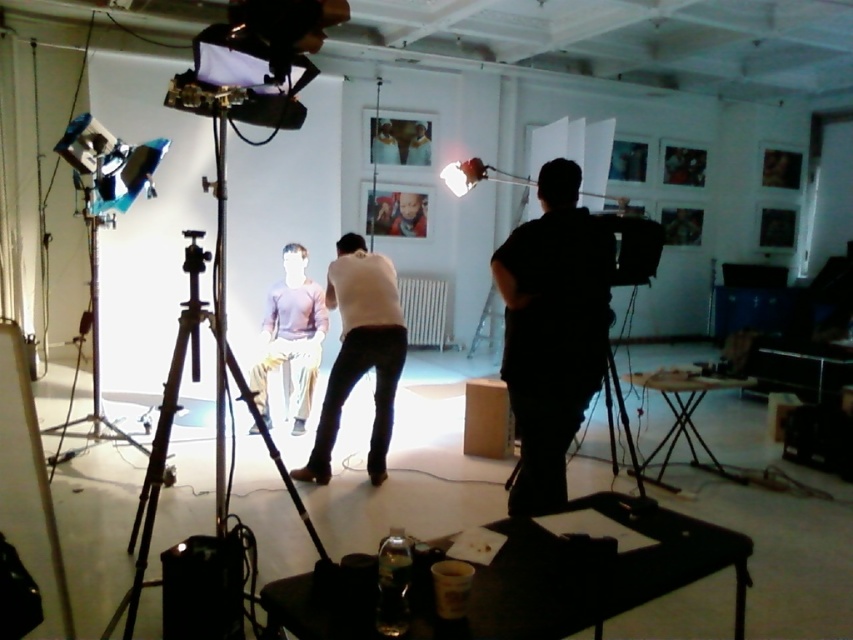
The image size is (853, 640). What do you see at coordinates (360, 353) in the screenshot?
I see `white matte shirt at center` at bounding box center [360, 353].

Is white matte shirt at center to the right of black matte tripod at center from the viewer's perspective?

Yes, white matte shirt at center is to the right of black matte tripod at center.

Is point (302, 474) in front of point (310, 522)?

That is False.

Image resolution: width=853 pixels, height=640 pixels. I want to click on white matte shirt at center, so click(360, 353).

Who is shorter, black matte shirt at right or smooth skin man at upper center?

Standing shorter between the two is smooth skin man at upper center.

How far apart are black matte shirt at right and smooth skin man at upper center?

A distance of 5.02 meters exists between black matte shirt at right and smooth skin man at upper center.

Where is `black matte shirt at right`? The width and height of the screenshot is (853, 640). black matte shirt at right is located at coordinates (550, 332).

From the picture: Does black matte shirt at right appear under matte purple shirt at center?

Yes.

Is point (552, 294) positioned before point (267, 365)?

Yes, it is.

I want to click on black matte shirt at right, so click(x=550, y=332).